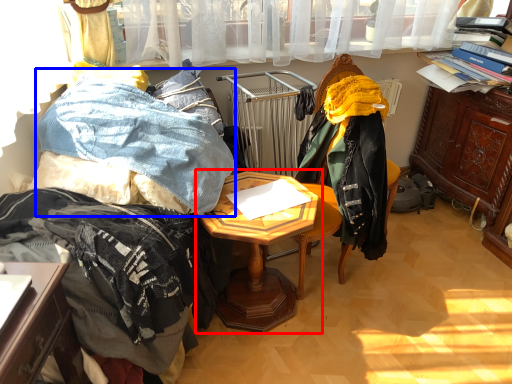
Question: Which object is further to the camera taking this photo, table (highlighted by a red box) or clothing (highlighted by a blue box)?

Choices:
 (A) table
 (B) clothing

Answer: (A)